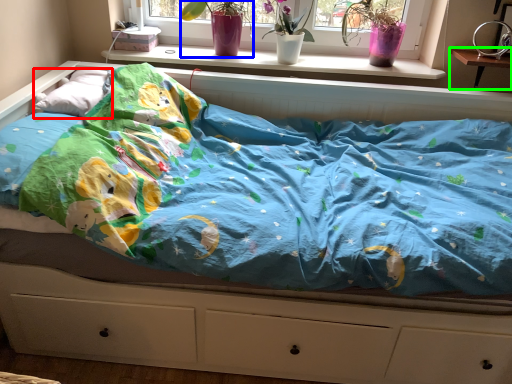
Question: Considering the real-world distances, which object is closest to pillow (highlighted by a red box)? floral arrangement (highlighted by a blue box) or changing table (highlighted by a green box).

Choices:
 (A) floral arrangement
 (B) changing table

Answer: (A)